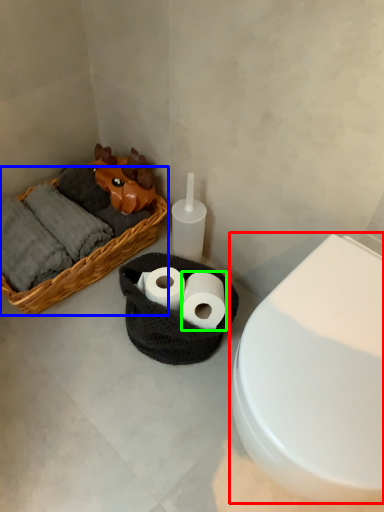
Question: Estimate the real-world distances between objects in this image. Which object is farther from toilet (highlighted by a red box), basket (highlighted by a blue box) or toilet paper (highlighted by a green box)?

Choices:
 (A) basket
 (B) toilet paper

Answer: (A)